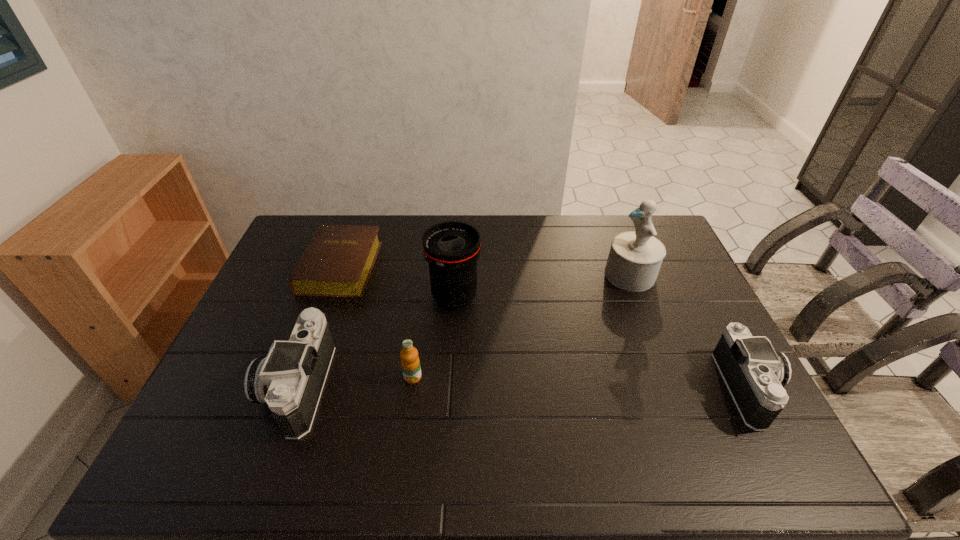
At what (x,y) coordinates should I click in order to perform the action: click on the third tallest object. Please return your answer as a coordinate pair (x, y). The width and height of the screenshot is (960, 540). Looking at the image, I should click on (291, 378).

The image size is (960, 540). I want to click on the left camera, so click(x=291, y=378).

Locate an element on the screen. the right camera is located at coordinates (755, 373).

Locate an element on the screen. the rightmost object is located at coordinates (755, 373).

Locate an element on the screen. The width and height of the screenshot is (960, 540). the shortest object is located at coordinates (337, 262).

At what (x,y) coordinates should I click in order to perform the action: click on the fifth object from left to right. Please return your answer as a coordinate pair (x, y). The image size is (960, 540). Looking at the image, I should click on (635, 257).

In order to click on the tallest object in this screenshot , I will do `click(635, 257)`.

Locate an element on the screen. The height and width of the screenshot is (540, 960). the fifth shortest object is located at coordinates (452, 248).

What are the coordinates of `orange juice` in the screenshot? It's located at (410, 362).

The height and width of the screenshot is (540, 960). I want to click on vacant space located on the right of the third tallest object, so click(411, 386).